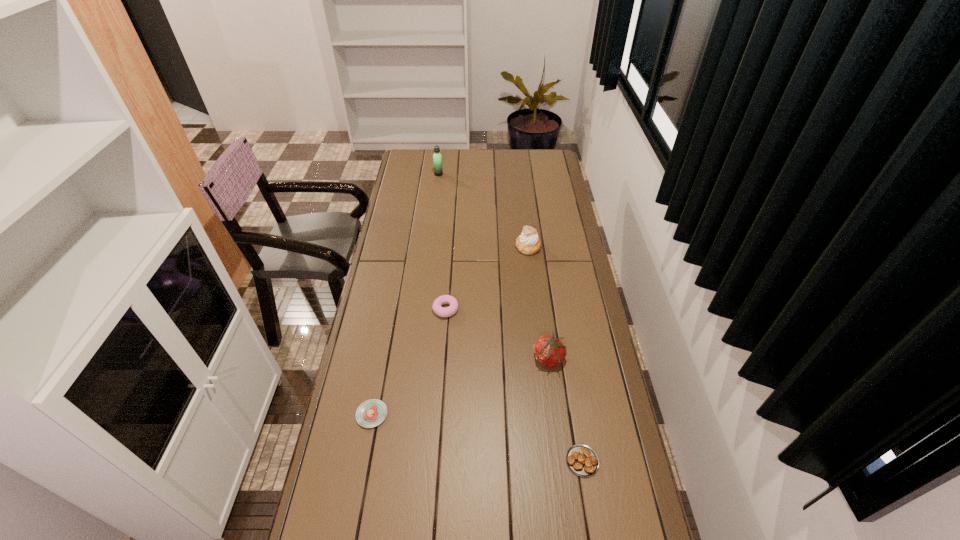
Image resolution: width=960 pixels, height=540 pixels. I want to click on the nearest object, so click(x=582, y=460).

Where is `free spot located on the left of the tallest object`? The width and height of the screenshot is (960, 540). free spot located on the left of the tallest object is located at coordinates [398, 174].

This screenshot has width=960, height=540. What are the coordinates of `vacant space located on the left of the farthest pastry` in the screenshot? It's located at (451, 247).

Image resolution: width=960 pixels, height=540 pixels. In order to click on free space located on the back of the tomato in this screenshot , I will do `click(544, 327)`.

I want to click on vacant space located 0.110m on the back of the fourth tallest object, so click(448, 279).

This screenshot has height=540, width=960. Find the location of `vacant space located on the back of the leftmost pastry`. vacant space located on the back of the leftmost pastry is located at coordinates (386, 341).

At what (x,y) coordinates should I click in order to perform the action: click on vacant position located on the back of the nearest object. Please return your answer as a coordinate pair (x, y). This screenshot has width=960, height=540. Looking at the image, I should click on (565, 356).

This screenshot has height=540, width=960. Identify the location of object at the far edge. (437, 158).

Locate an element on the screen. The height and width of the screenshot is (540, 960). object at the left edge is located at coordinates (371, 413).

The height and width of the screenshot is (540, 960). I want to click on tomato that is at the right edge, so click(x=550, y=352).